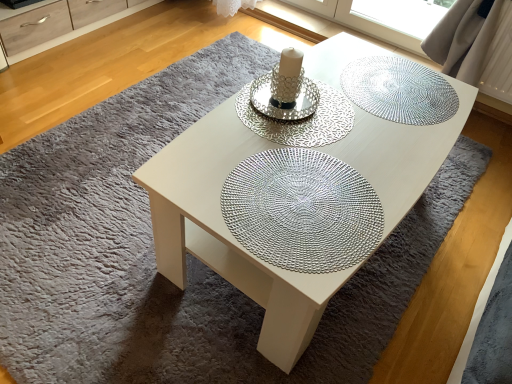
This screenshot has height=384, width=512. What are the coordinates of `vacant space in front of metallic silver doily at upper right, positioned as the third glass plate in front-to-back order` in the screenshot? It's located at (397, 148).